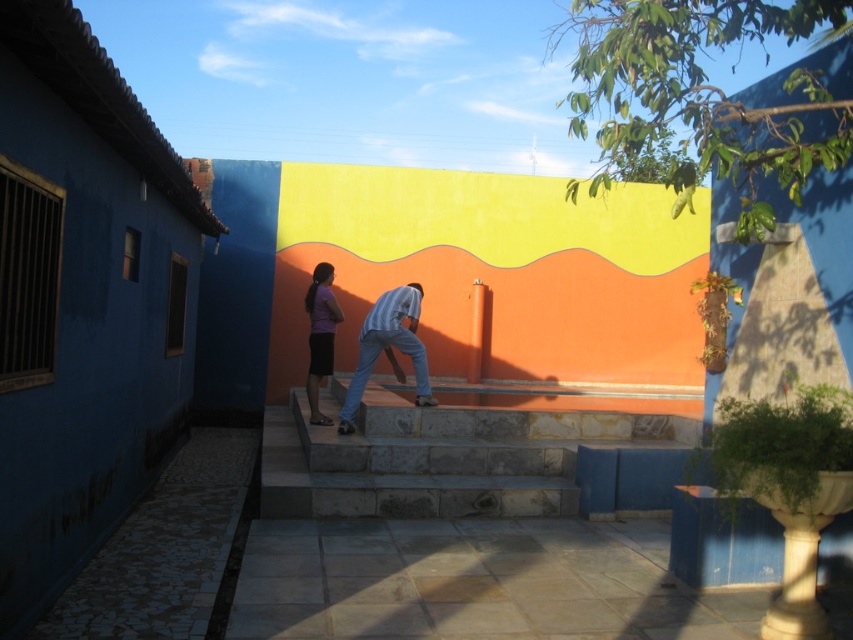
You are standing in front of the colorful wall and see the point marked at coordinates (387, 348). What object does this point correspond to?

The point at coordinates (387, 348) corresponds to the light blue jeans at center.

You are standing in front of the colorful wall and notice the natural stone stairs at center and the purple matte skirt at center. Which object takes up more space in the scene?

The natural stone stairs at center is bigger than the purple matte skirt at center, so it takes up more space in the scene.

You are standing in front of the colorful wall and want to reach the basin of the fountain. The basin is at the same level as the natural stone stairs at center. Since the light blue jeans at center are near the stairs, are you able to step onto the stairs to reach the basin?

The natural stone stairs at center is located below the light blue jeans at center, so yes, you can step onto the stairs to reach the basin since the stairs are positioned lower than where the light blue jeans at center are located.